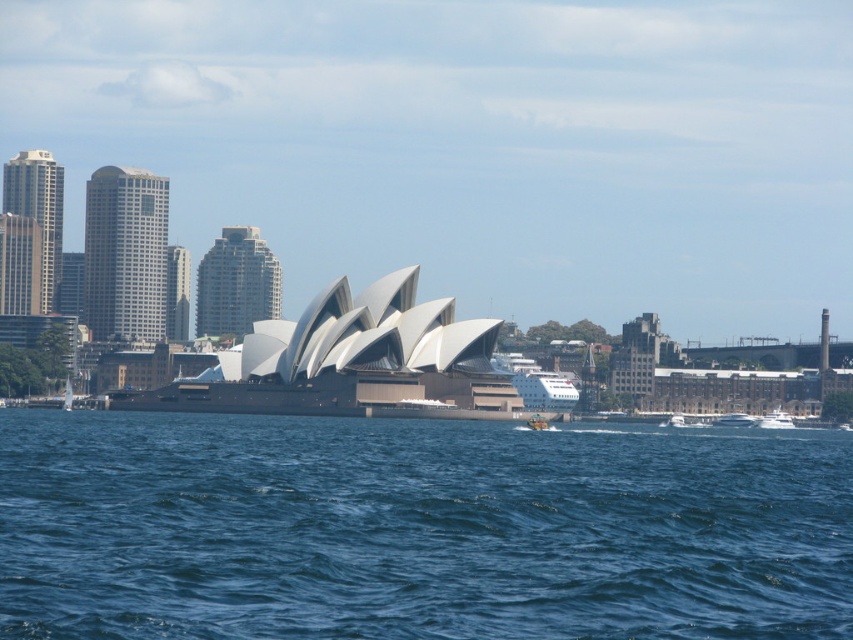
Who is shorter, blue water at center or white matte boat at lower right?

With less height is white matte boat at lower right.

Find the location of `blue water at center`. blue water at center is located at coordinates (416, 529).

Does point (172, 440) come closer to viewer compared to point (682, 419)?

Yes.

At what (x,y) coordinates should I click in order to perform the action: click on blue water at center. Please return your answer as a coordinate pair (x, y). The height and width of the screenshot is (640, 853). Looking at the image, I should click on (416, 529).

Does blue water at center have a greater height compared to white glossy boat at lower right?

Correct, blue water at center is much taller as white glossy boat at lower right.

Does blue water at center appear on the right side of white glossy boat at lower right?

Incorrect, blue water at center is not on the right side of white glossy boat at lower right.

Where is `blue water at center`? blue water at center is located at coordinates (416, 529).

Between white glossy boat at lower right and white matte boat at lower right, which one is positioned lower?

Positioned lower is white matte boat at lower right.

Between point (729, 422) and point (703, 426), which one is positioned in front?

Positioned in front is point (703, 426).

Is point (730, 416) behind point (677, 420)?

That is True.

What are the coordinates of `white glossy boat at lower right` in the screenshot? It's located at (734, 419).